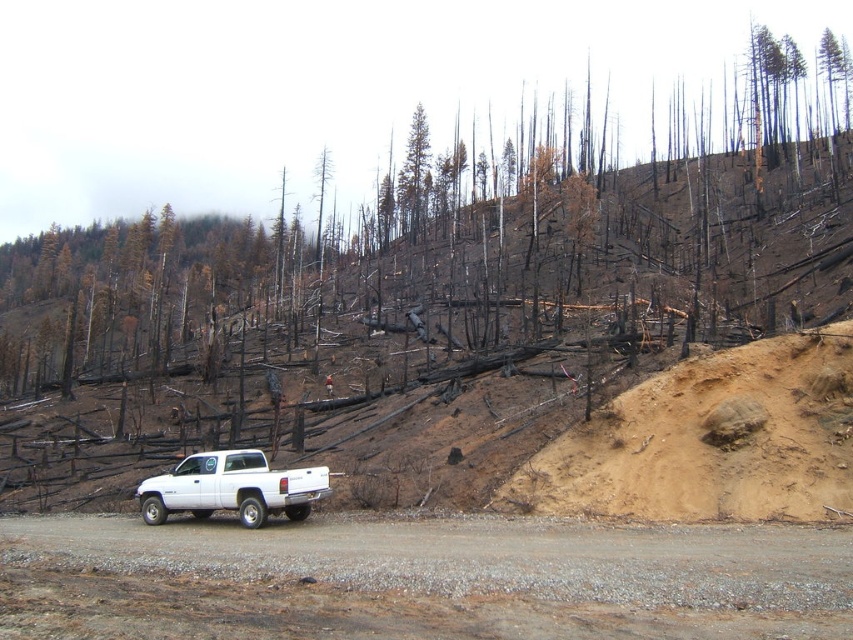
Is point (312, 28) farther from viewer compared to point (244, 499)?

Yes, it is behind point (244, 499).

Is point (126, 182) in front of point (231, 456)?

No, (126, 182) is behind (231, 456).

Identify the location of burnt wood at center. (315, 88).

Is brown sandy hillside at center positioned before brown bark tree at center?

Yes, brown sandy hillside at center is in front of brown bark tree at center.

Does brown sandy hillside at center appear on the right side of brown bark tree at center?

Correct, you'll find brown sandy hillside at center to the right of brown bark tree at center.

Does point (802, 502) come closer to viewer compared to point (410, 177)?

Yes, it is in front of point (410, 177).

This screenshot has width=853, height=640. What are the coordinates of `brown sandy hillside at center` in the screenshot? It's located at (711, 440).

Can you confirm if gray gravel road at center is positioned to the left of brown bark tree at center?

No, gray gravel road at center is not to the left of brown bark tree at center.

Is gray gravel road at center taller than brown bark tree at center?

No, gray gravel road at center is not taller than brown bark tree at center.

Between point (38, 540) and point (410, 228), which one is positioned behind?

Point (410, 228)

Locate an element on the screen. The image size is (853, 640). gray gravel road at center is located at coordinates (419, 579).